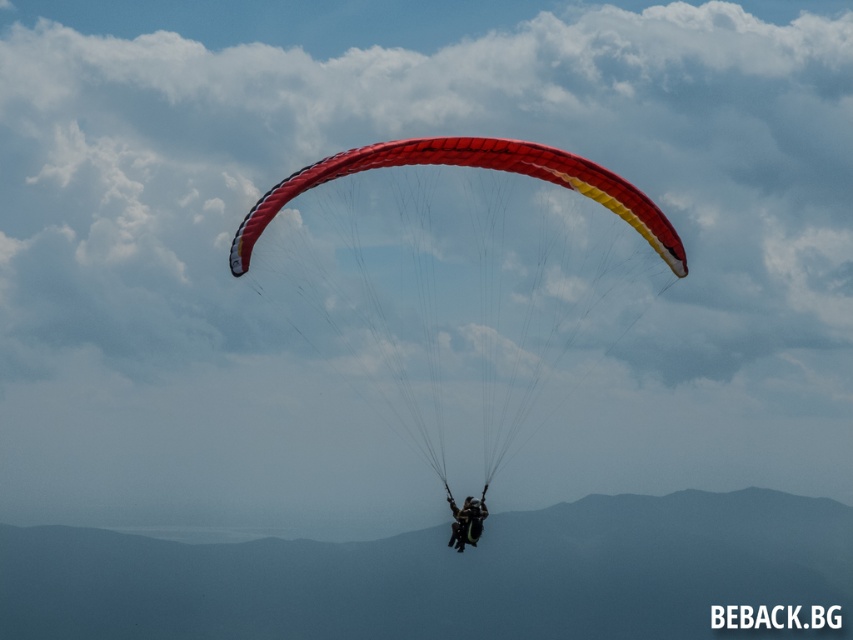
You are a pilot observing two paragliders in the sky. You notice a red fabric parachute at center and a black fabric parachute at center. Which one is closer to you?

The red fabric parachute at center is closer to you because it is in front of the black fabric parachute at center.

Looking at this image, you are a pilot in a small airplane flying at the same altitude as the paraglider. You see the point marked at coordinates point (x=457, y=280). What object is located at that point?

The point (x=457, y=280) marks the red fabric parachute at center.